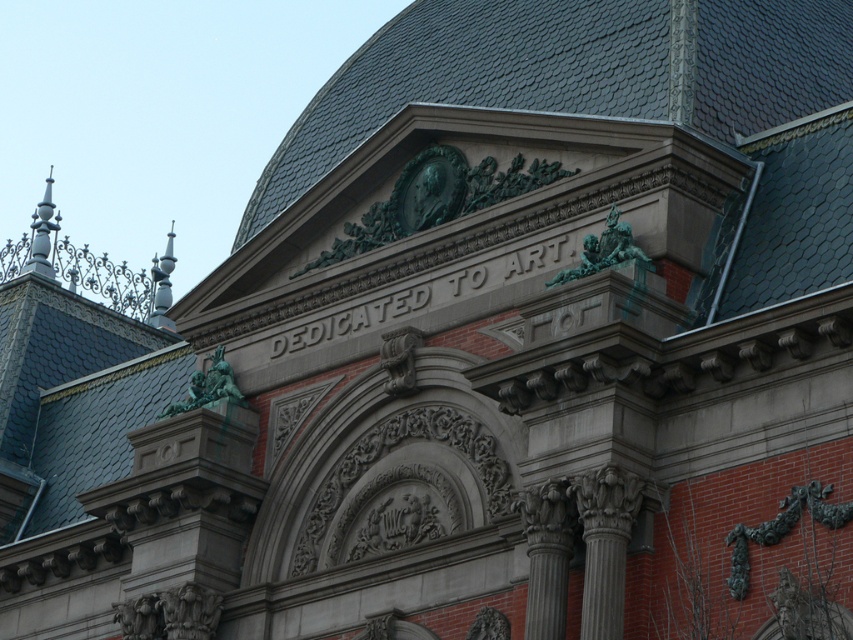
Question: Which object appears farthest from the camera in this image?

Choices:
 (A) polished silver spire at upper left
 (B) white glossy spire at upper left

Answer: (B)

Question: Where is gray stone column at right located in relation to polished silver spire at upper left in the image?

Choices:
 (A) above
 (B) below

Answer: (B)

Question: Among these points, which one is nearest to the camera?

Choices:
 (A) (170, 252)
 (B) (35, 230)
 (C) (563, 577)

Answer: (C)

Question: Observing the image, what is the correct spatial positioning of green patina bust at center in reference to polished silver spire at upper left?

Choices:
 (A) below
 (B) above

Answer: (A)

Question: Which object is the farthest from the gray stone column at center?

Choices:
 (A) gray stone column at right
 (B) polished silver spire at upper left
 (C) white glossy spire at upper left
 (D) green patina bust at center

Answer: (C)

Question: Does gray stone column at right have a larger size compared to white glossy spire at upper left?

Choices:
 (A) no
 (B) yes

Answer: (A)